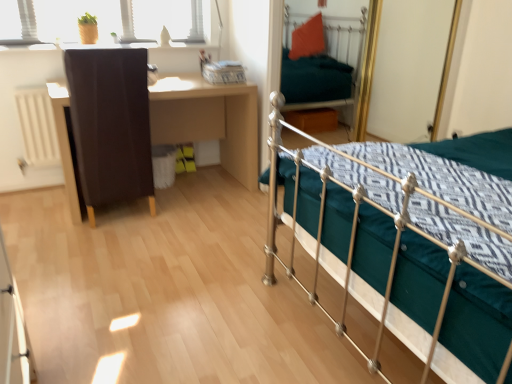
Where is `free area in between brown wooden desk at left and matte brown cabinet at left`? Image resolution: width=512 pixels, height=384 pixels. free area in between brown wooden desk at left and matte brown cabinet at left is located at coordinates (180, 206).